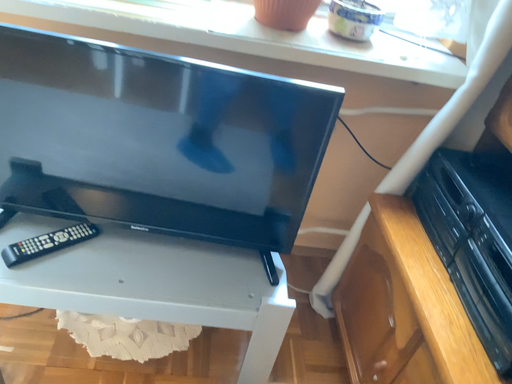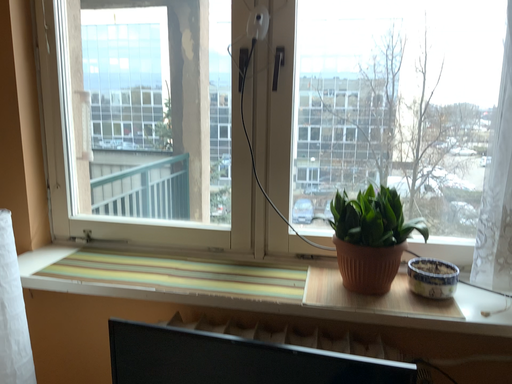
Question: How did the camera likely rotate when shooting the video?

Choices:
 (A) rotated right
 (B) rotated left

Answer: (B)